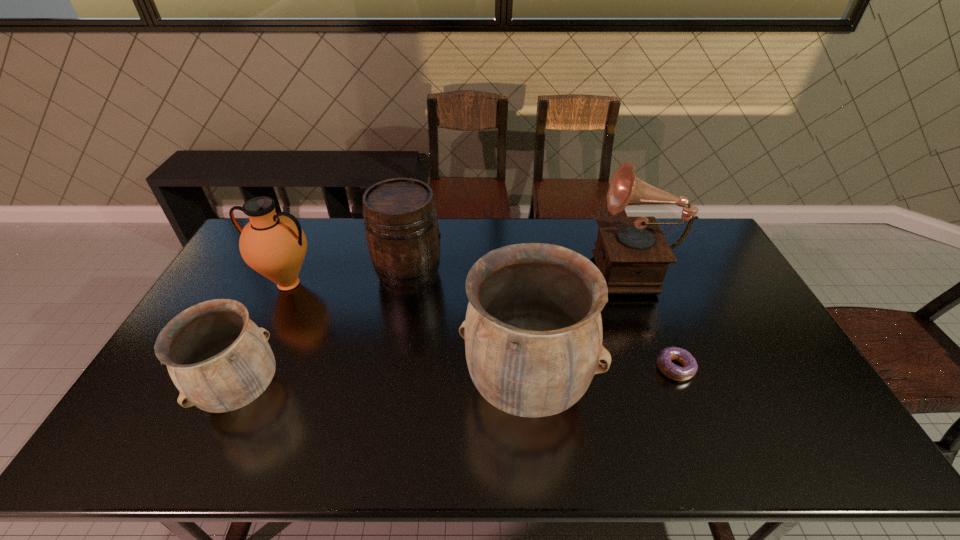
Where is `the fifth tallest object`? This screenshot has width=960, height=540. the fifth tallest object is located at coordinates tap(219, 359).

At what (x,y) coordinates should I click in order to perform the action: click on the shorter urn. Please return your answer as a coordinate pair (x, y). Looking at the image, I should click on (219, 359).

Locate an element on the screen. the right urn is located at coordinates (533, 334).

Where is `the fourth object from left to right`? This screenshot has width=960, height=540. the fourth object from left to right is located at coordinates (533, 334).

Identify the location of record player. The image size is (960, 540). (632, 253).

Locate an element on the screen. The image size is (960, 540). the third object from left to right is located at coordinates (401, 225).

Locate an element on the screen. The image size is (960, 540). doughnut is located at coordinates pos(664,363).

Locate an element on the screen. The image size is (960, 540). pitcher is located at coordinates (274, 245).

Locate an element on the screen. The height and width of the screenshot is (540, 960). vacant space situated on the right of the left urn is located at coordinates (318, 392).

At what (x,y) coordinates should I click in order to perform the action: click on free space located 0.340m on the back of the right urn. Please return your answer as a coordinate pair (x, y). The height and width of the screenshot is (540, 960). Looking at the image, I should click on (516, 265).